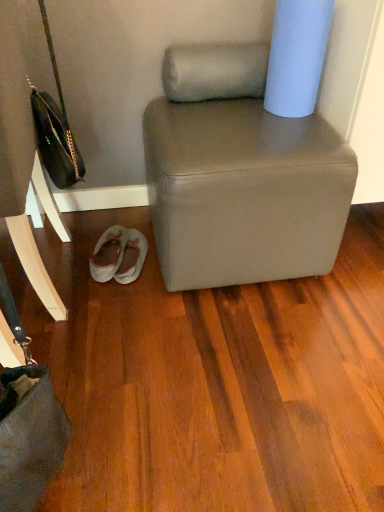
The height and width of the screenshot is (512, 384). What are the coordinates of `vacant area that is in front of light blue matte toilet paper at upper right` in the screenshot? It's located at coord(280,129).